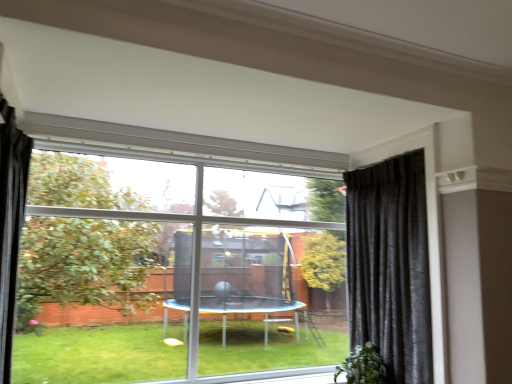
Question: Considering the positions of transparent glass window at center and black velvet curtain at left, placed as the 2th curtain when sorted from back to front, in the image, is transparent glass window at center taller or shorter than black velvet curtain at left, placed as the 2th curtain when sorted from back to front,?

Choices:
 (A) short
 (B) tall

Answer: (B)

Question: Visually, is transparent glass window at center positioned to the left or to the right of black velvet curtain at left, placed as the first curtain when sorted from front to back?

Choices:
 (A) left
 (B) right

Answer: (B)

Question: Considering the real-world distances, which object is farthest from the black velvet curtain at right, positioned as the 1th curtain in right-to-left order?

Choices:
 (A) green leafy plant at lower right
 (B) black velvet curtain at left, placed as the first curtain when sorted from front to back
 (C) transparent glass window at center

Answer: (B)

Question: Estimate the real-world distances between objects in this image. Which object is farther from the black velvet curtain at right, which ranks as the first curtain in back-to-front order?

Choices:
 (A) green leafy plant at lower right
 (B) transparent glass window at center
 (C) black velvet curtain at left, placed as the 2th curtain when sorted from back to front

Answer: (C)